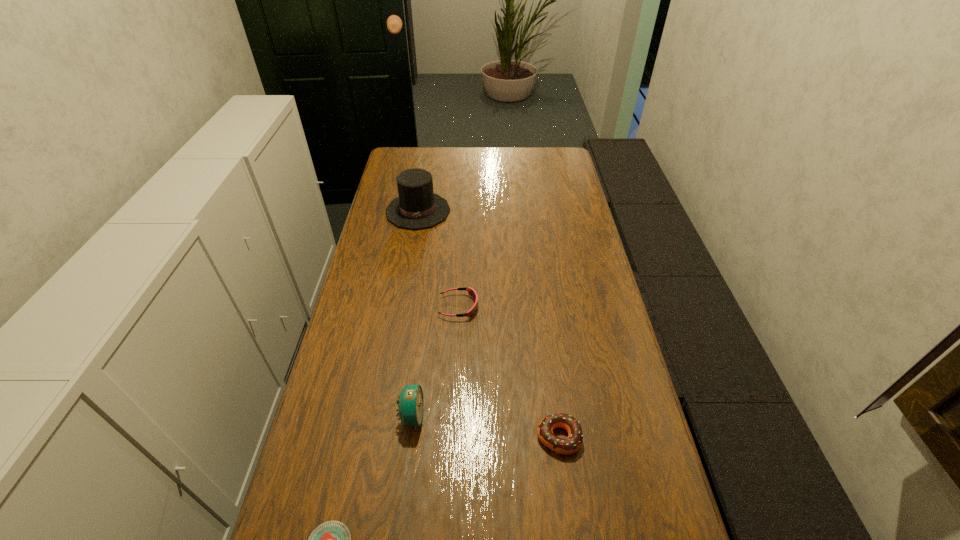
This screenshot has height=540, width=960. In order to click on dress hat in this screenshot , I will do `click(417, 207)`.

The width and height of the screenshot is (960, 540). What are the coordinates of `the tallest object` in the screenshot? It's located at (417, 207).

What are the coordinates of `the second tallest object` in the screenshot? It's located at (410, 403).

At what (x,y) coordinates should I click in order to perform the action: click on the rightmost object. Please return your answer as a coordinate pair (x, y). This screenshot has height=540, width=960. Looking at the image, I should click on (571, 444).

Where is `goggles`? The height and width of the screenshot is (540, 960). goggles is located at coordinates (471, 292).

Locate an element on the screen. This screenshot has width=960, height=540. vacant region located 0.090m on the front of the dress hat with the decoration is located at coordinates (412, 247).

Image resolution: width=960 pixels, height=540 pixels. In order to click on free space located on the front-facing side of the fourth shortest object in this screenshot , I will do `click(548, 416)`.

You are a GUI agent. You are given a task and a screenshot of the screen. Output one action in this format:
    pyautogui.click(x=<x>, y=<y>)
    Task: Click on the vacant space located 0.350m on the back of the doughnut
    The height and width of the screenshot is (540, 960).
    Given the screenshot: What is the action you would take?
    pyautogui.click(x=542, y=312)

Find the location of a particular element. vacant region located on the front-facing side of the second farthest object is located at coordinates (575, 307).

I want to click on object that is at the left edge, so click(417, 207).